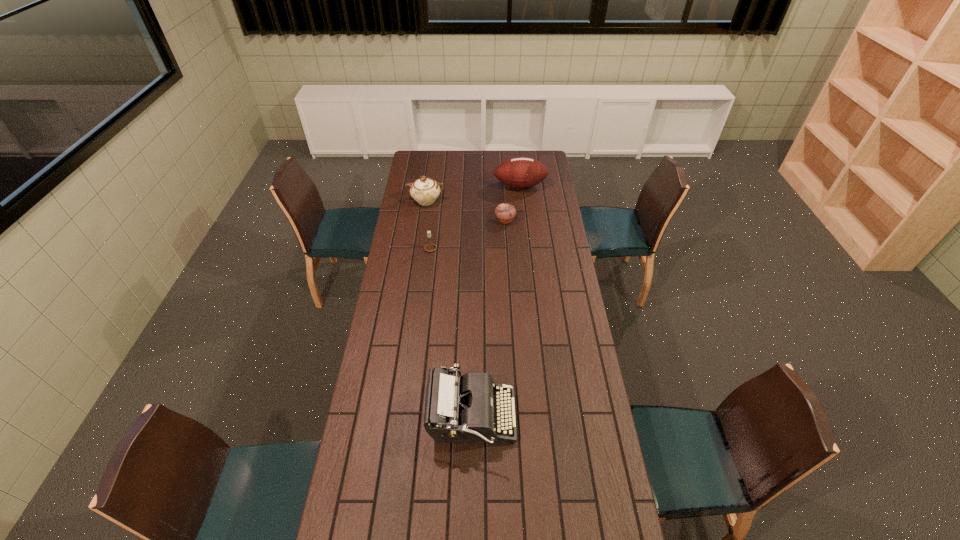
The width and height of the screenshot is (960, 540). In the image, there is a desktop. Find the location of `vacant space at the far left corner`. vacant space at the far left corner is located at coordinates (412, 169).

This screenshot has height=540, width=960. In order to click on vacant space at the far right corner in this screenshot , I will do `click(539, 157)`.

Identify the location of free space between the chinaware and the muffin. (466, 211).

Identify the location of vacant point located between the nearest object and the shortest object. (489, 319).

Image resolution: width=960 pixels, height=540 pixels. I want to click on blank region between the shortest object and the nearest object, so click(489, 319).

Where is `empty space that is in between the typewriter and the chinaware`? The height and width of the screenshot is (540, 960). empty space that is in between the typewriter and the chinaware is located at coordinates (449, 309).

At what (x,y) coordinates should I click in order to perform the action: click on free space between the second shortest object and the football (American). Please return your answer as a coordinate pair (x, y). Looking at the image, I should click on (475, 217).

Image resolution: width=960 pixels, height=540 pixels. I want to click on vacant area between the football (American) and the typewriter, so click(x=496, y=302).

You are a GUI agent. You are given a task and a screenshot of the screen. Output one action in this format:
    pyautogui.click(x=<x>, y=<y>)
    Task: Click on the vacant space that is in between the chinaware and the football (American)
    
    Given the screenshot: What is the action you would take?
    pyautogui.click(x=473, y=193)

Select which object is the second closest to the chinaware. Please provide its 2D coordinates. Your answer should be formatted as a tuple, i.e. [(x, y)], where the tuple contains the x and y coordinates of a point satisfying the conditions above.

[(519, 172)]